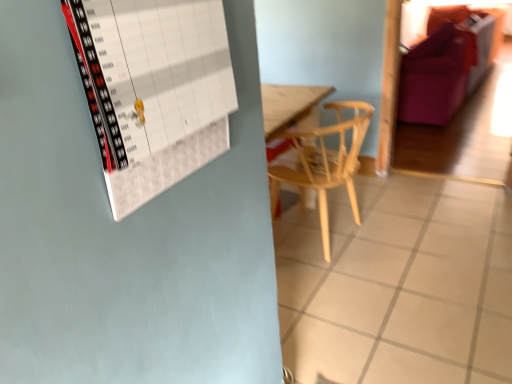
The image size is (512, 384). I want to click on free point above white tile at center (from a real-world perspective), so click(x=391, y=252).